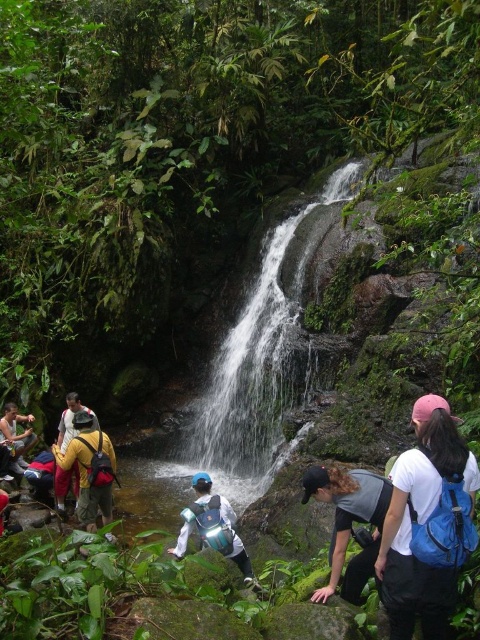
The height and width of the screenshot is (640, 480). What do you see at coordinates (90, 468) in the screenshot?
I see `yellow backpack at lower left` at bounding box center [90, 468].

Does yellow backpack at lower left appear over white matte wetsuit at center?

No, yellow backpack at lower left is not above white matte wetsuit at center.

Is point (88, 428) positioned after point (243, 550)?

That is True.

At what (x,y) coordinates should I click in order to perform the action: click on yellow backpack at lower left. Please return your answer as a coordinate pair (x, y). The width and height of the screenshot is (480, 640). Looking at the image, I should click on (90, 468).

Is white matte backpack at right to the right of green mossy rock at center from the viewer's perspective?

Correct, you'll find white matte backpack at right to the right of green mossy rock at center.

Which is behind, point (402, 595) or point (343, 618)?

The point (343, 618) is more distant.

Locate an element on the screen. Image resolution: width=480 pixels, height=640 pixels. white matte backpack at right is located at coordinates (428, 524).

Between white smooth waterfall at center and green mossy rock at center, which one is positioned higher?

white smooth waterfall at center

Is the position of white smooth waterfall at center less distant than that of green mossy rock at center?

No, it is behind green mossy rock at center.

Locate an element on the screen. white smooth waterfall at center is located at coordinates (253, 368).